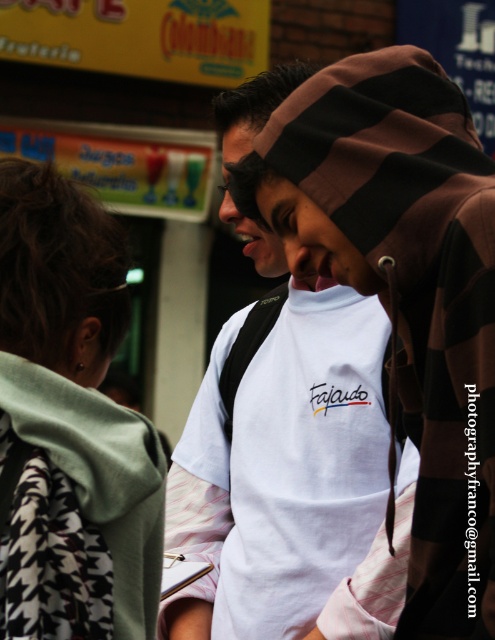
Does green houndstooth scarf at left have a larger size compared to matte black face at center?

Incorrect, green houndstooth scarf at left is not larger than matte black face at center.

This screenshot has width=495, height=640. In order to click on green houndstooth scarf at left in this screenshot , I will do `click(70, 422)`.

Locate an element on the screen. This screenshot has height=640, width=495. green houndstooth scarf at left is located at coordinates (70, 422).

Does green houndstooth scarf at left have a larger size compared to white matte t-shirt at center?

No.

Does green houndstooth scarf at left have a lesser width compared to white matte t-shirt at center?

Yes.

What do you see at coordinates (70, 422) in the screenshot?
I see `green houndstooth scarf at left` at bounding box center [70, 422].

You are a GUI agent. You are given a task and a screenshot of the screen. Output one action in this format:
    pyautogui.click(x=<x>, y=<y>)
    Task: Click on the green houndstooth scarf at left
    Image resolution: width=495 pixels, height=640 pixels.
    Given the screenshot: What is the action you would take?
    pyautogui.click(x=70, y=422)

Consider the image. Which of these two, white matte t-shirt at center or matte black face at center, stands shorter?

With less height is white matte t-shirt at center.

In the scene shown: Does white matte t-shirt at center have a lesser height compared to matte black face at center?

Indeed, white matte t-shirt at center has a lesser height compared to matte black face at center.

Which is in front, point (295, 253) or point (232, 132)?

Point (295, 253) is more forward.

Image resolution: width=495 pixels, height=640 pixels. Identify the location of white matte t-shirt at center. (311, 237).